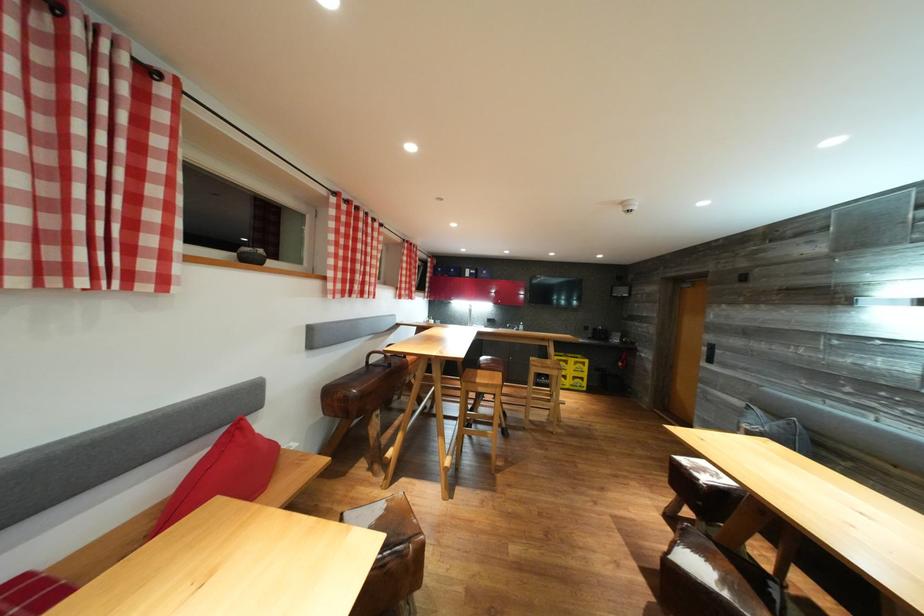
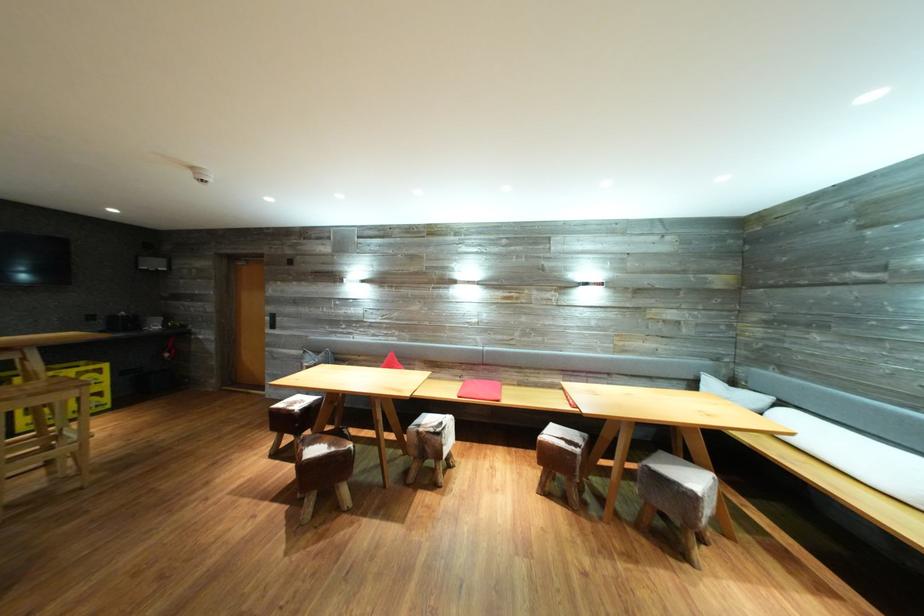
Question: How did the camera likely rotate?

Choices:
 (A) Left
 (B) Right
 (C) Up
 (D) Down

Answer: (B)